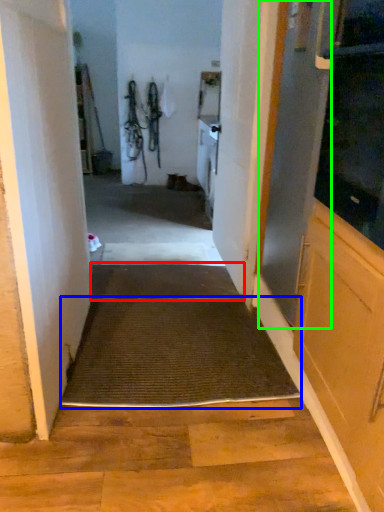
Question: Estimate the real-world distances between objects in this image. Which object is farther from doormat (highlighted by a red box), doormat (highlighted by a blue box) or screen door (highlighted by a green box)?

Choices:
 (A) doormat
 (B) screen door

Answer: (B)